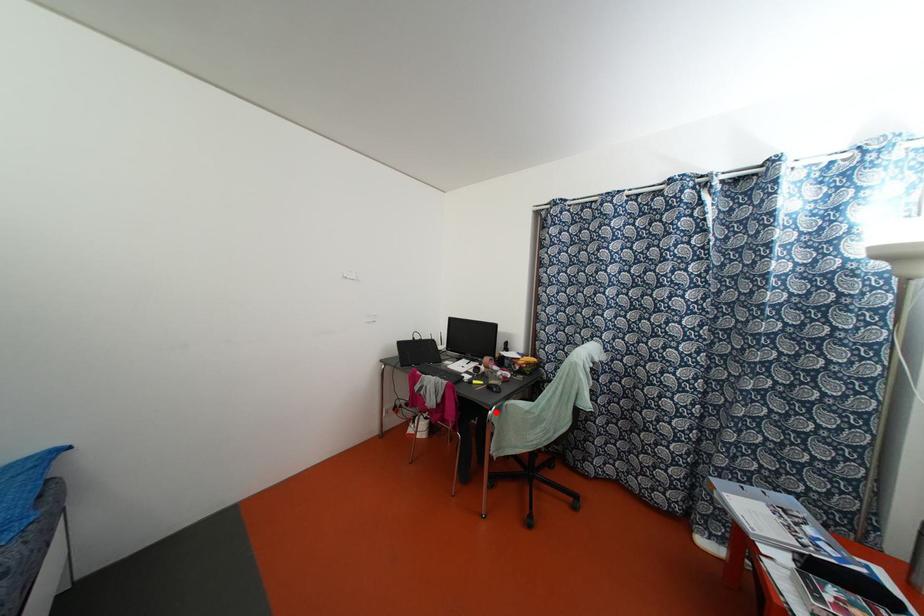
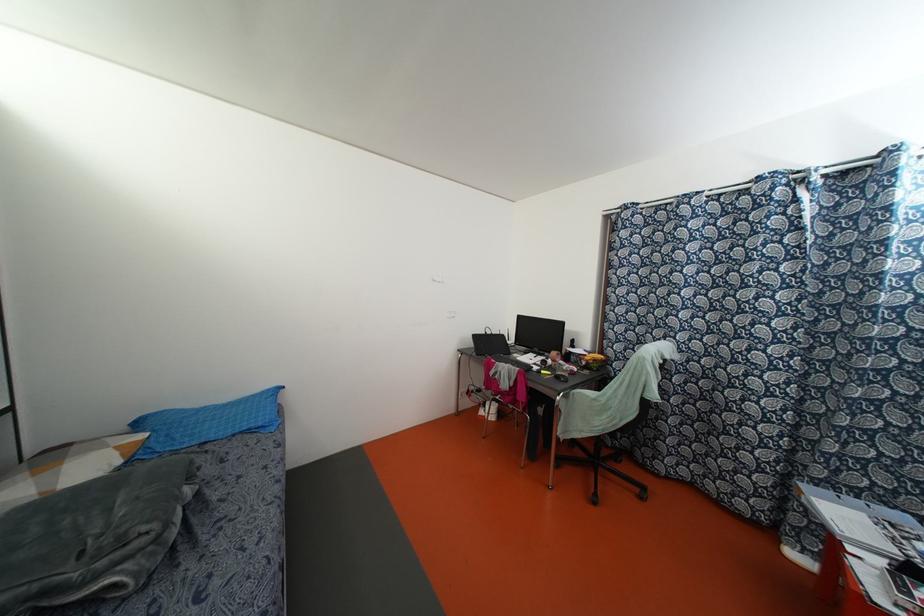
Question: I am providing you with two images of the same scene from different viewpoints. Image1 has a red point marked. In image2, the corresponding 3D location appears at what relative position? Reply with the corresponding letter.

Choices:
 (A) Closer
 (B) Farther

Answer: (A)